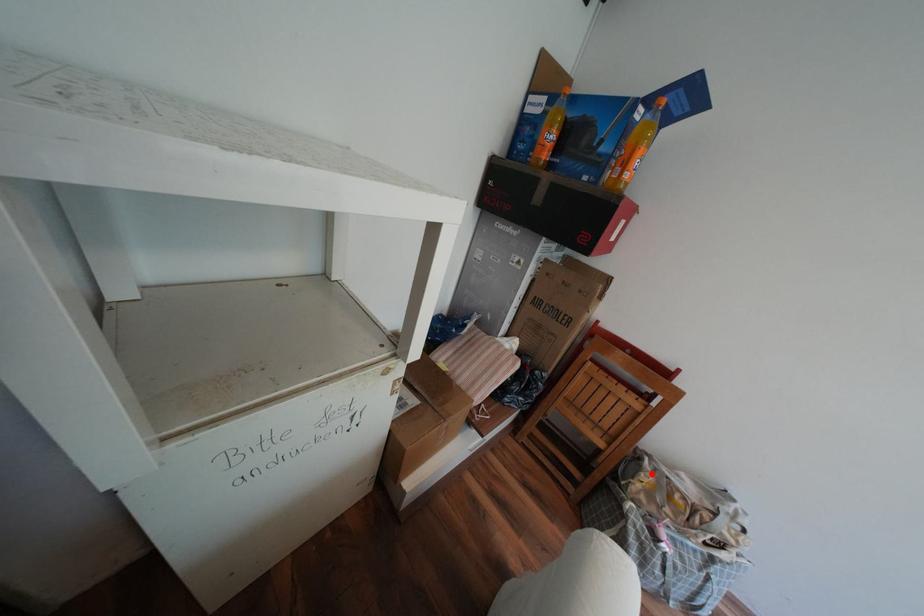
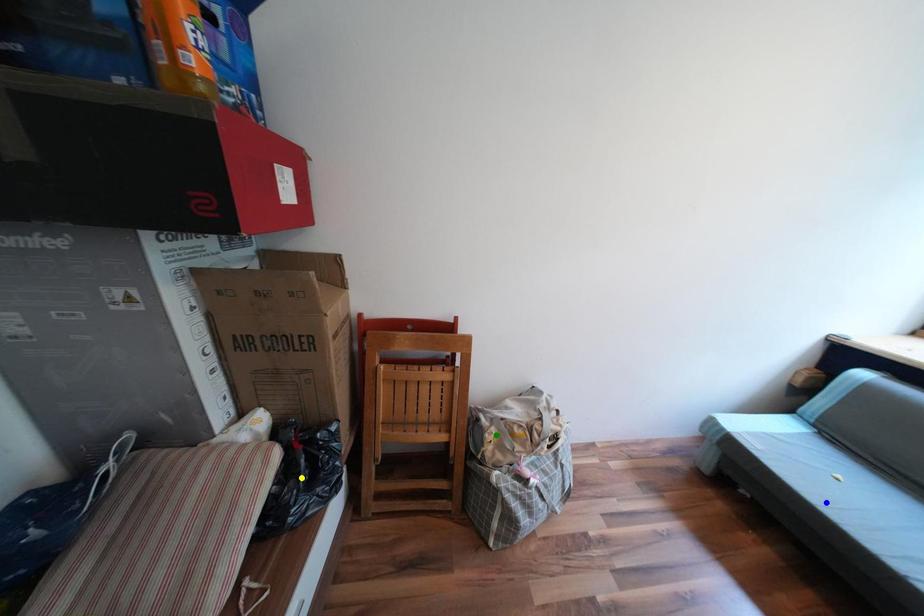
Question: I am providing you with two images of the same scene from different viewpoints. A red point is marked on the first image. You are given multiple points on the second image. Which point in image 2 is actually the same real-world point as the red point in image 1?

Choices:
 (A) blue point
 (B) green point
 (C) yellow point

Answer: (B)